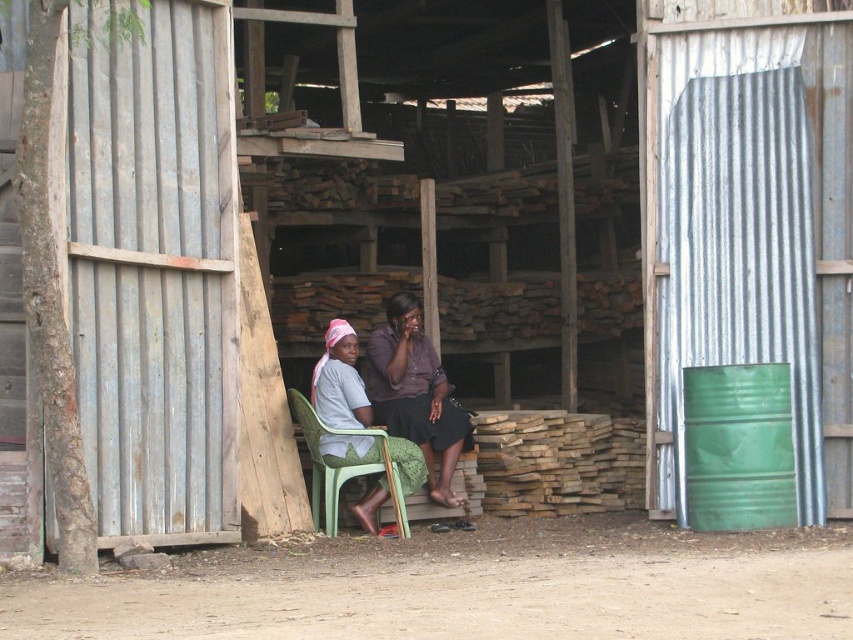
Who is shorter, matte purple blouse at center or green plastic chair at center?

green plastic chair at center

Does matte purple blouse at center appear over green plastic chair at center?

Correct, matte purple blouse at center is located above green plastic chair at center.

This screenshot has width=853, height=640. In order to click on matte purple blouse at center in this screenshot , I will do `click(415, 394)`.

At what (x,y) coordinates should I click in order to perform the action: click on matte purple blouse at center. Please return your answer as a coordinate pair (x, y). This screenshot has height=640, width=853. Looking at the image, I should click on (415, 394).

From the picture: Who is taller, green matte barrel at right or green plastic chair at center?

Standing taller between the two is green matte barrel at right.

Is green matte barrel at right bigger than green plastic chair at center?

Incorrect, green matte barrel at right is not larger than green plastic chair at center.

What are the coordinates of `green matte barrel at right` in the screenshot? It's located at (738, 448).

The height and width of the screenshot is (640, 853). Find the location of `green matte barrel at right`. green matte barrel at right is located at coordinates (738, 448).

From the picture: Does green matte barrel at right have a greater height compared to matte purple blouse at center?

No.

The width and height of the screenshot is (853, 640). I want to click on green matte barrel at right, so click(x=738, y=448).